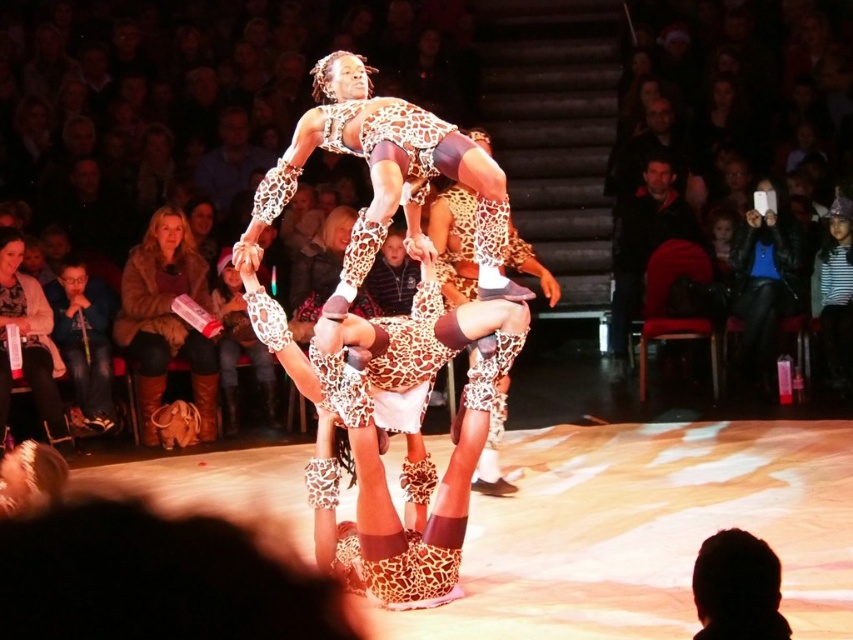
Question: Is leather boots at lower left closer to camera compared to matte brown leather jacket at left?

Choices:
 (A) yes
 (B) no

Answer: (B)

Question: Which point is farther to the camera?

Choices:
 (A) matte brown leather jacket at left
 (B) leather boots at lower left

Answer: (B)

Question: Does leather boots at lower left come in front of matte brown leather jacket at left?

Choices:
 (A) yes
 (B) no

Answer: (B)

Question: Which point appears closest to the camera in this image?

Choices:
 (A) (82, 422)
 (B) (186, 292)

Answer: (A)

Question: Among these points, which one is farthest from the camera?

Choices:
 (A) (160, 248)
 (B) (83, 305)

Answer: (A)

Question: Can you confirm if leather boots at lower left is positioned to the left of matte brown leather jacket at left?

Choices:
 (A) yes
 (B) no

Answer: (B)